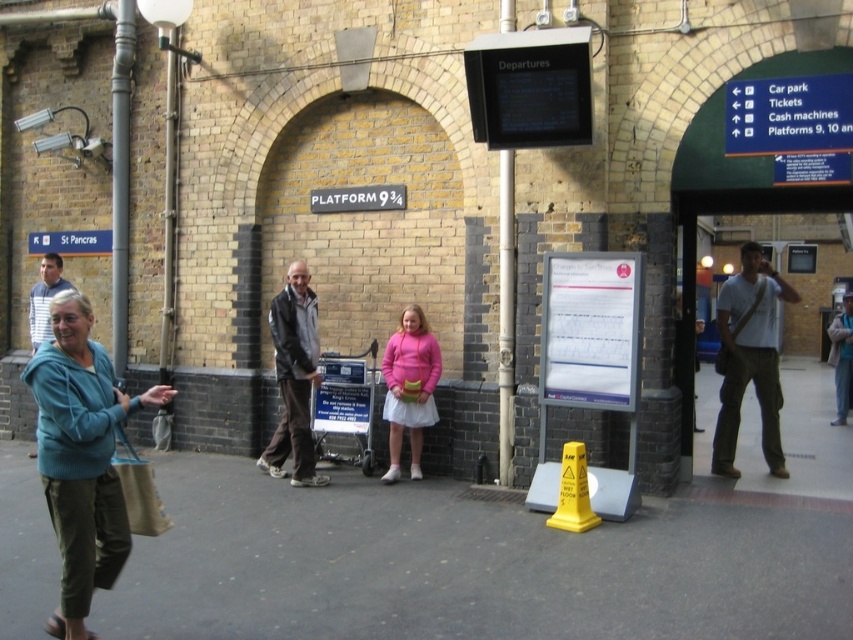
From the picture: You are a photographer standing at the train station near Platform 9 3.4. You need to take a photo that includes both the teal fleece jacket at lower left and the silver metallic pole at center. Based on their heights, which object will appear shorter in the photo?

The teal fleece jacket at lower left will appear shorter in the photo because it is not as tall as the silver metallic pole at center.

You are standing at the entrance of Platform 9 34 and want to walk to the gray asphalt pavement at lower center. What direction should you move in to reach it?

The gray asphalt pavement at lower center is located at point [469,564], so you should move towards the lower center direction to reach it.

You are standing at Platform 9 3 4 and want to walk towards the light gray cotton shirt at right. Which direction should you move relative to the gray asphalt pavement at lower center?

You should move upwards relative to the gray asphalt pavement at lower center because the light gray cotton shirt at right is located above it.